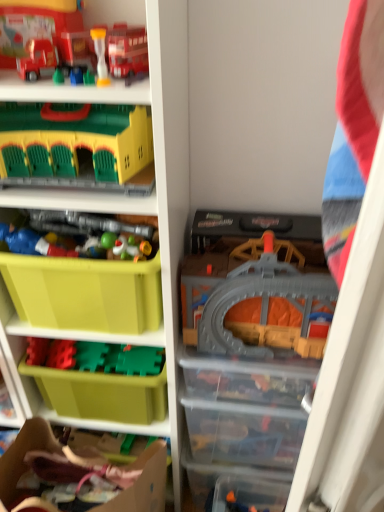
The height and width of the screenshot is (512, 384). Describe the element at coordinates (143, 483) in the screenshot. I see `cardboard at lower left` at that location.

What do you see at coordinates (155, 166) in the screenshot?
I see `matte plastic shelf at center` at bounding box center [155, 166].

Find the location of a particular element. This screenshot has width=384, height=512. green plastic storage box at lower left is located at coordinates (104, 382).

At what (x,y) coordinates should I click in order to perform the action: click on orange matte toy car at lower center, which appears as the 1th toy when ordered from the bottom. Please return your answer as a coordinate pair (x, y). Looking at the image, I should click on (240, 505).

What is the approximate width of translucent plastic hourglass at upper left, marked as the 2th toy in a top-to-bottom arrangement?

0.96 inches.

What do you see at coordinates (100, 55) in the screenshot? I see `translucent plastic hourglass at upper left, marked as the 2th toy in a top-to-bottom arrangement` at bounding box center [100, 55].

Locate an element on the screen. matte plastic toy car at upper left, the seventh toy when ordered from bottom to top is located at coordinates (44, 30).

What is the approximate height of matte plastic toy car at upper left, the seventh toy when ordered from bottom to top?

3.48 inches.

What are the coordinates of `cardboard at lower left` in the screenshot? It's located at (143, 483).

How different are the orientations of matte plastic toy car at upper left, the seventh toy when ordered from bottom to top, and orange matte toy car at lower center, which appears as the 1th toy when ordered from the bottom, in degrees?

matte plastic toy car at upper left, the seventh toy when ordered from bottom to top, and orange matte toy car at lower center, which appears as the 1th toy when ordered from the bottom, are facing 46.9 degrees away from each other.

From the image's perspective, which is above, matte plastic toy car at upper left, the seventh toy when ordered from bottom to top, or orange matte toy car at lower center, which appears as the 1th toy when ordered from the bottom?

From the image's view, matte plastic toy car at upper left, the seventh toy when ordered from bottom to top, is above.

Measure the distance from matte plastic toy car at upper left, the seventh toy when ordered from bottom to top, to orange matte toy car at lower center, arranged as the seventh toy when viewed from the top.

A distance of 1.22 meters exists between matte plastic toy car at upper left, the seventh toy when ordered from bottom to top, and orange matte toy car at lower center, arranged as the seventh toy when viewed from the top.

Where is `the 3rd toy to the right of the matte plastic toy car at upper left, which is the 1th toy in top-to-bottom order, counting from the anchor's position`? The height and width of the screenshot is (512, 384). the 3rd toy to the right of the matte plastic toy car at upper left, which is the 1th toy in top-to-bottom order, counting from the anchor's position is located at coordinates (240, 505).

Find the location of a particular element. This screenshot has width=384, height=512. storage box beneath the translucent plastic hourglass at upper left, marked as the 2th toy in a top-to-bottom arrangement (from a real-world perspective) is located at coordinates [104, 382].

In terms of size, does green plastic storage box at lower left appear bigger or smaller than translucent plastic hourglass at upper left, marked as the 2th toy in a top-to-bottom arrangement?

Considering their sizes, green plastic storage box at lower left takes up more space than translucent plastic hourglass at upper left, marked as the 2th toy in a top-to-bottom arrangement.

Is green plastic storage box at lower left oriented away from translucent plastic hourglass at upper left, marked as the 2th toy in a top-to-bottom arrangement?

green plastic storage box at lower left does not have its back to translucent plastic hourglass at upper left, marked as the 2th toy in a top-to-bottom arrangement.

Considering the relative positions of green plastic storage box at lower left and translucent plastic hourglass at upper left, marked as the 2th toy in a top-to-bottom arrangement, in the image provided, is green plastic storage box at lower left to the right of translucent plastic hourglass at upper left, marked as the 2th toy in a top-to-bottom arrangement, from the viewer's perspective?

No, green plastic storage box at lower left is not to the right of translucent plastic hourglass at upper left, marked as the 2th toy in a top-to-bottom arrangement.

Which object is wider, orange matte toy car at lower center, which appears as the 1th toy when ordered from the bottom, or gray plastic train set at center, the sixth toy viewed from the top?

With larger width is gray plastic train set at center, the sixth toy viewed from the top.

Is the position of orange matte toy car at lower center, which appears as the 1th toy when ordered from the bottom, more distant than that of gray plastic train set at center, the sixth toy viewed from the top?

Yes, orange matte toy car at lower center, which appears as the 1th toy when ordered from the bottom, is further from the camera.

Is gray plastic train set at center, which appears as the 2th toy when ordered from the bottom, at the back of orange matte toy car at lower center, arranged as the seventh toy when viewed from the top?

orange matte toy car at lower center, arranged as the seventh toy when viewed from the top, does not have its back to gray plastic train set at center, which appears as the 2th toy when ordered from the bottom.

Considering the sizes of objects orange matte toy car at lower center, arranged as the seventh toy when viewed from the top, and gray plastic train set at center, which appears as the 2th toy when ordered from the bottom, in the image provided, who is shorter, orange matte toy car at lower center, arranged as the seventh toy when viewed from the top, or gray plastic train set at center, which appears as the 2th toy when ordered from the bottom,?

orange matte toy car at lower center, arranged as the seventh toy when viewed from the top, is shorter.

Relative to matte plastic shelf at center, is matte plastic toy car at upper left, the seventh toy when ordered from bottom to top, in front or behind?

Clearly, matte plastic toy car at upper left, the seventh toy when ordered from bottom to top, is behind matte plastic shelf at center.

Looking at their sizes, would you say matte plastic toy car at upper left, which is the 1th toy in top-to-bottom order, is wider or thinner than matte plastic shelf at center?

Considering their sizes, matte plastic toy car at upper left, which is the 1th toy in top-to-bottom order, looks slimmer than matte plastic shelf at center.

From a real-world perspective, is matte plastic toy car at upper left, the seventh toy when ordered from bottom to top, over matte plastic shelf at center?

Yes, from a real-world perspective, matte plastic toy car at upper left, the seventh toy when ordered from bottom to top, is over matte plastic shelf at center

From the picture: How many degrees apart are the facing directions of translucent plastic hourglass at upper left, the sixth toy positioned from the bottom, and gray plastic train set at center, the sixth toy viewed from the top?

The angular difference between translucent plastic hourglass at upper left, the sixth toy positioned from the bottom, and gray plastic train set at center, the sixth toy viewed from the top, is 0.904 degrees.

Considering the positions of objects translucent plastic hourglass at upper left, the sixth toy positioned from the bottom, and gray plastic train set at center, which appears as the 2th toy when ordered from the bottom, in the image provided, who is in front, translucent plastic hourglass at upper left, the sixth toy positioned from the bottom, or gray plastic train set at center, which appears as the 2th toy when ordered from the bottom,?

translucent plastic hourglass at upper left, the sixth toy positioned from the bottom, is closer to the camera.

From a real-world perspective, relative to gray plastic train set at center, which appears as the 2th toy when ordered from the bottom, is translucent plastic hourglass at upper left, the sixth toy positioned from the bottom, vertically above or below?

From a real-world perspective, translucent plastic hourglass at upper left, the sixth toy positioned from the bottom, is physically above gray plastic train set at center, which appears as the 2th toy when ordered from the bottom.

Based on the photo, are translucent plastic hourglass at upper left, marked as the 2th toy in a top-to-bottom arrangement, and gray plastic train set at center, which appears as the 2th toy when ordered from the bottom, located far from each other?

No, there isn't a large distance between translucent plastic hourglass at upper left, marked as the 2th toy in a top-to-bottom arrangement, and gray plastic train set at center, which appears as the 2th toy when ordered from the bottom.

Where is `shelf in front of the green plastic building block at upper left, the fifth toy in the bottom-to-top sequence`? shelf in front of the green plastic building block at upper left, the fifth toy in the bottom-to-top sequence is located at coordinates (155, 166).

Which object is further away from the camera, green plastic building block at upper left, which appears as the third toy when viewed from the top, or matte plastic shelf at center?

Positioned behind is green plastic building block at upper left, which appears as the third toy when viewed from the top.

Is green plastic building block at upper left, the fifth toy in the bottom-to-top sequence, completely or partially outside of matte plastic shelf at center?

No, green plastic building block at upper left, the fifth toy in the bottom-to-top sequence, is not entirely external to matte plastic shelf at center.

Is green plastic building block at upper left, which appears as the third toy when viewed from the top, taller or shorter than matte plastic shelf at center?

Clearly, green plastic building block at upper left, which appears as the third toy when viewed from the top, is shorter compared to matte plastic shelf at center.

Based on the photo, considering the sizes of green plastic building block at upper left, which appears as the third toy when viewed from the top, and cardboard at lower left in the image, is green plastic building block at upper left, which appears as the third toy when viewed from the top, bigger or smaller than cardboard at lower left?

Considering their sizes, green plastic building block at upper left, which appears as the third toy when viewed from the top, takes up less space than cardboard at lower left.

Is point (27, 172) closer to viewer compared to point (152, 506)?

Yes, point (27, 172) is closer to viewer.

From the picture: Can you confirm if green plastic building block at upper left, the fifth toy in the bottom-to-top sequence, is taller than cardboard at lower left?

In fact, green plastic building block at upper left, the fifth toy in the bottom-to-top sequence, may be shorter than cardboard at lower left.

Visually, is green plastic building block at upper left, the fifth toy in the bottom-to-top sequence, positioned to the left or to the right of cardboard at lower left?

Clearly, green plastic building block at upper left, the fifth toy in the bottom-to-top sequence, is on the right of cardboard at lower left in the image.

Find the location of `the 3rd toy counting from the left side of the orange matte toy car at lower center, arranged as the seventh toy when viewed from the top`. the 3rd toy counting from the left side of the orange matte toy car at lower center, arranged as the seventh toy when viewed from the top is located at coordinates (44, 30).

From the green plastic storage box at lower left, count 5th toys forward and point to it. Please provide its 2D coordinates.

[(100, 55)]

When comparing their distances from cardboard at lower left, does matte plastic toy car at upper left, which is the 1th toy in top-to-bottom order, or green plastic storage box at lower left seem closer?

green plastic storage box at lower left is closer to cardboard at lower left.

From the image, which object appears to be farther from cardboard at lower left, plastic toy soldiers at center, the fourth toy ordered from the bottom, or translucent plastic hourglass at upper left, the sixth toy positioned from the bottom?

translucent plastic hourglass at upper left, the sixth toy positioned from the bottom, is further to cardboard at lower left.

Based on their spatial positions, is gray plastic train set at center, the sixth toy viewed from the top, or cardboard at lower left closer to translucent plastic hourglass at upper left, marked as the 2th toy in a top-to-bottom arrangement?

gray plastic train set at center, the sixth toy viewed from the top, is closer to translucent plastic hourglass at upper left, marked as the 2th toy in a top-to-bottom arrangement.

Estimate the real-world distances between objects in this image. Which object is closer to gray plastic train set at center, the sixth toy viewed from the top, orange matte toy car at lower center, arranged as the seventh toy when viewed from the top, or plastic toy soldiers at center, the fourth toy ordered from the bottom?

plastic toy soldiers at center, the fourth toy ordered from the bottom, lies closer to gray plastic train set at center, the sixth toy viewed from the top, than the other object.

From the image, which object appears to be nearer to orange matte toy car at lower center, arranged as the seventh toy when viewed from the top, matte plastic toy car at upper left, which is the 1th toy in top-to-bottom order, or gray plastic train set at center, the sixth toy viewed from the top?

Among the two, gray plastic train set at center, the sixth toy viewed from the top, is located nearer to orange matte toy car at lower center, arranged as the seventh toy when viewed from the top.

Estimate the real-world distances between objects in this image. Which object is further from green plastic building block at upper left, which appears as the third toy when viewed from the top, translucent plastic hourglass at upper left, the sixth toy positioned from the bottom, or plastic toy soldiers at center, acting as the fourth toy starting from the top?

translucent plastic hourglass at upper left, the sixth toy positioned from the bottom.

From the image, which object appears to be nearer to green plastic building block at upper left, the fifth toy in the bottom-to-top sequence, gray plastic train set at center, which appears as the 2th toy when ordered from the bottom, or plastic toy soldiers at center, acting as the fourth toy starting from the top?

plastic toy soldiers at center, acting as the fourth toy starting from the top.

From the image, which object appears to be farther from green plastic building block at upper left, which appears as the third toy when viewed from the top, matte plastic toy car at upper left, the seventh toy when ordered from bottom to top, or matte plastic toy at left, placed as the 5th toy when sorted from top to bottom?

matte plastic toy at left, placed as the 5th toy when sorted from top to bottom, is further to green plastic building block at upper left, which appears as the third toy when viewed from the top.

Locate an element on the screen. The height and width of the screenshot is (512, 384). storage box between translucent plastic hourglass at upper left, marked as the 2th toy in a top-to-bottom arrangement, and cardboard at lower left from top to bottom is located at coordinates (104, 382).

Locate an element on the screen. toy between matte plastic toy car at upper left, the seventh toy when ordered from bottom to top, and green plastic building block at upper left, the fifth toy in the bottom-to-top sequence, in the vertical direction is located at coordinates (100, 55).

Find the location of a particular element. storage box between matte plastic toy car at upper left, which is the 1th toy in top-to-bottom order, and orange matte toy car at lower center, arranged as the seventh toy when viewed from the top, from top to bottom is located at coordinates (104, 382).

Image resolution: width=384 pixels, height=512 pixels. In order to click on storage box that lies between matte plastic shelf at center and orange matte toy car at lower center, arranged as the seventh toy when viewed from the top, from top to bottom in this screenshot , I will do 104,382.